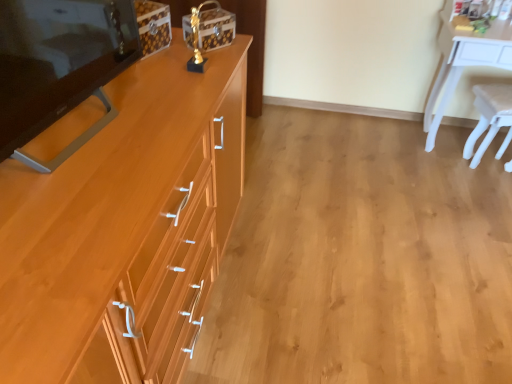
Question: From a real-world perspective, is matte wood changing table at left physically located above or below white plastic chair at right?

Choices:
 (A) above
 (B) below

Answer: (A)

Question: Based on their sizes in the image, would you say matte wood changing table at left is bigger or smaller than white plastic chair at right?

Choices:
 (A) small
 (B) big

Answer: (B)

Question: Which object is positioned closest to the white glossy desk at upper right?

Choices:
 (A) light brown wood cabinet at left
 (B) wooden drawer at center-left
 (C) matte wood changing table at left
 (D) white plastic chair at right

Answer: (D)

Question: Which object is positioned closest to the wooden drawer at center-left?

Choices:
 (A) white glossy desk at upper right
 (B) white plastic chair at right
 (C) light brown wood cabinet at left
 (D) matte wood changing table at left

Answer: (B)